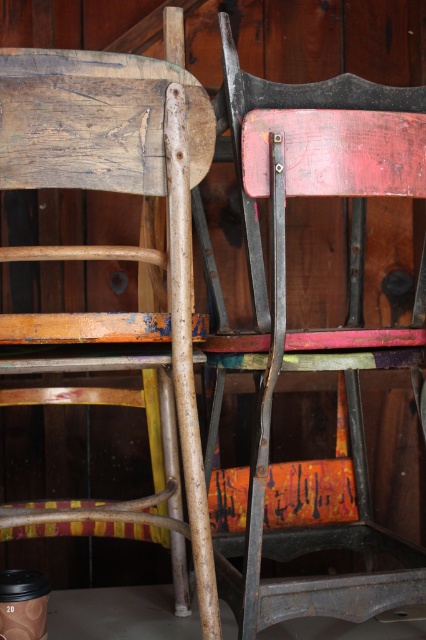
Question: Which point is closer to the camera taking this photo?

Choices:
 (A) (241, 163)
 (B) (144, 156)

Answer: (B)

Question: Which of the following is the closest to the observer?

Choices:
 (A) red painted wood chair at center
 (B) wooden chair at center

Answer: (B)

Question: Is red painted wood chair at center to the right of wooden chair at center from the viewer's perspective?

Choices:
 (A) no
 (B) yes

Answer: (B)

Question: Does red painted wood chair at center appear under wooden chair at center?

Choices:
 (A) yes
 (B) no

Answer: (B)

Question: Is red painted wood chair at center thinner than wooden chair at center?

Choices:
 (A) yes
 (B) no

Answer: (B)

Question: Which point appears farthest from the camera in this image?

Choices:
 (A) (253, 492)
 (B) (77, 172)

Answer: (A)